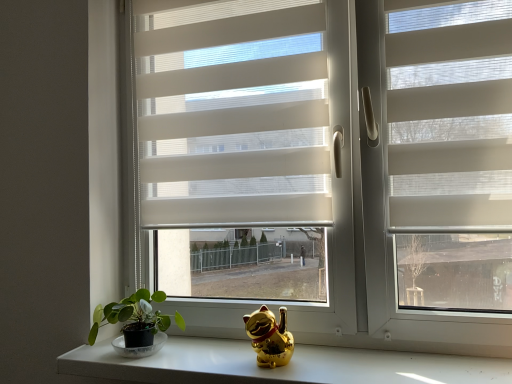
You are a GUI agent. You are given a task and a screenshot of the screen. Output one action in this format:
    pyautogui.click(x=<x>, y=<y>)
    Task: Click on the vacant location below green matte plant at lower left (from a real-world perspective)
    
    Given the screenshot: What is the action you would take?
    pyautogui.click(x=130, y=360)